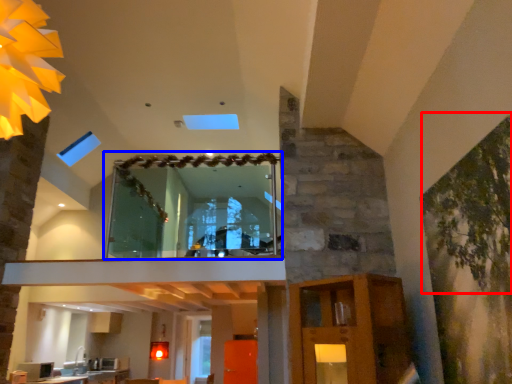
Question: Which of the following is the farthest to the observer, plant (highlighted by a red box) or window (highlighted by a blue box)?

Choices:
 (A) plant
 (B) window

Answer: (B)